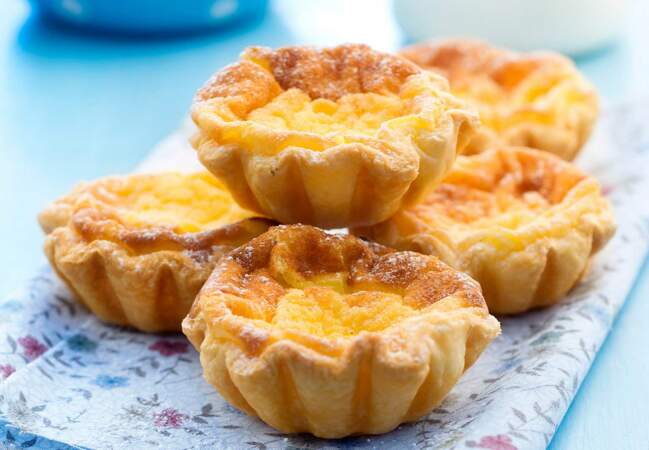
Locate an element on the screen. This screenshot has height=450, width=649. floral pattern on napkin is located at coordinates (36, 345), (167, 422), (167, 351), (498, 442).